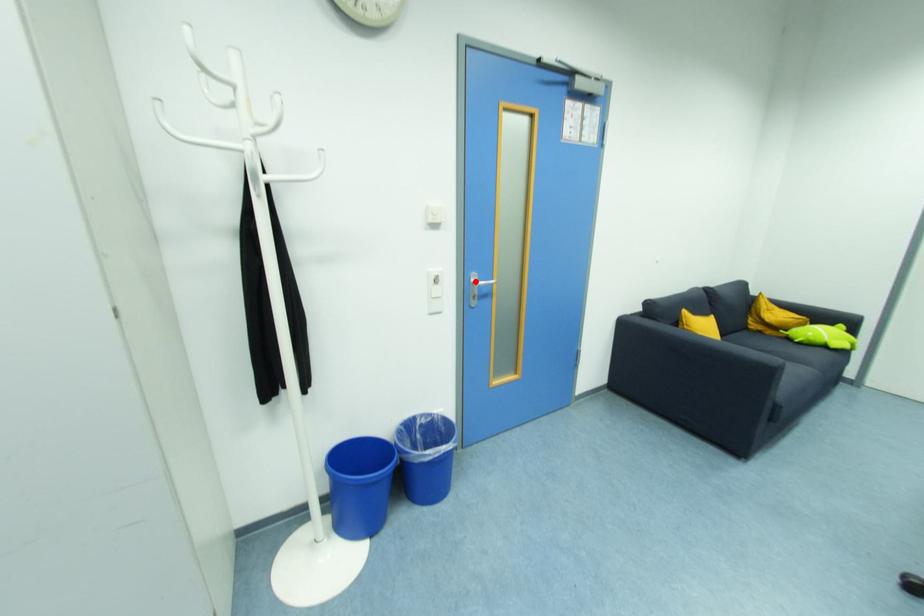
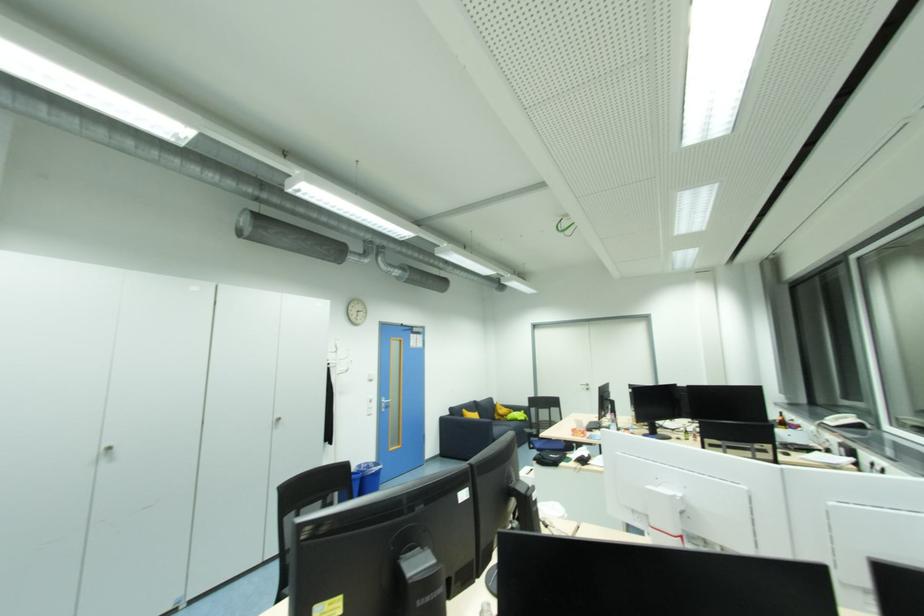
The point at the highlighted location is marked in the first image. Where is the corresponding point in the second image?

(386, 402)